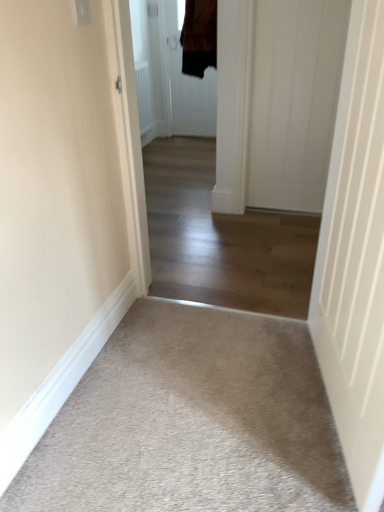
Describe the element at coordinates (199, 37) in the screenshot. I see `brown suede jacket at upper center` at that location.

Where is `beige carpet at lower left`? The image size is (384, 512). beige carpet at lower left is located at coordinates (192, 421).

Find the location of a particular element. brown fabric door at center, the 1th door positioned from the left is located at coordinates pyautogui.click(x=191, y=99).

Identify the location of light beige carpet at center. Image resolution: width=384 pixels, height=512 pixels. (221, 238).

In the scene shown: What is the approximate height of white smooth door at right, the third door positioned from the back?

white smooth door at right, the third door positioned from the back, is 1.02 meters tall.

The width and height of the screenshot is (384, 512). In order to click on brown suede jacket at upper center in this screenshot , I will do `click(199, 37)`.

Considering the sizes of objects brown fabric door at center, the first door positioned from the back, and white smooth door at right, the second door when ordered from left to right, in the image provided, who is taller, brown fabric door at center, the first door positioned from the back, or white smooth door at right, the second door when ordered from left to right,?

Standing taller between the two is brown fabric door at center, the first door positioned from the back.

Considering the sizes of objects brown fabric door at center, the 1th door positioned from the left, and white smooth door at right, the third door positioned from the back, in the image provided, who is thinner, brown fabric door at center, the 1th door positioned from the left, or white smooth door at right, the third door positioned from the back,?

Thinner between the two is brown fabric door at center, the 1th door positioned from the left.

Can you confirm if brown fabric door at center, the first door positioned from the back, is positioned to the right of white smooth door at right, the 1th door from the front?

No, brown fabric door at center, the first door positioned from the back, is not to the right of white smooth door at right, the 1th door from the front.

Does light beige carpet at center come in front of brown fabric door at center, the 3th door positioned from the bottom?

Yes, it is.

Is light beige carpet at center oriented away from brown fabric door at center, the 1th door when ordered from top to bottom?

No, light beige carpet at center's orientation is not away from brown fabric door at center, the 1th door when ordered from top to bottom.

Is light beige carpet at center directly adjacent to brown fabric door at center, which ranks as the third door in front-to-back order?

No, light beige carpet at center is not touching brown fabric door at center, which ranks as the third door in front-to-back order.

How different are the orientations of light beige carpet at center and brown fabric door at center, which ranks as the third door in front-to-back order, in degrees?

There is a 1.04-degree angle between the facing directions of light beige carpet at center and brown fabric door at center, which ranks as the third door in front-to-back order.

How different are the orientations of white smooth door at right, the first door from the bottom, and light beige carpet at center in degrees?

79.2 degrees.

Does white smooth door at right, which is the 3th door in top-to-bottom order, have a lesser height compared to light beige carpet at center?

In fact, white smooth door at right, which is the 3th door in top-to-bottom order, may be taller than light beige carpet at center.

Is the depth of white smooth door at right, the third door positioned from the back, less than that of light beige carpet at center?

Yes, the depth of white smooth door at right, the third door positioned from the back, is less than that of light beige carpet at center.

From the image's perspective, is white smooth door at right, the 1th door from the front, above or below light beige carpet at center?

Based on their image positions, white smooth door at right, the 1th door from the front, is located beneath light beige carpet at center.

What are the coordinates of `corridor behind the beige carpet at lower left` in the screenshot? It's located at (221, 238).

Is beige carpet at lower left next to light beige carpet at center and touching it?

No, beige carpet at lower left is not making contact with light beige carpet at center.

Which object is positioned more to the right, beige carpet at lower left or light beige carpet at center?

Positioned to the right is beige carpet at lower left.

Could you tell me if beige carpet at lower left is facing light beige carpet at center?

Yes, beige carpet at lower left is aimed at light beige carpet at center.

From a real-world perspective, is white smooth door at right, the first door from the bottom, over brown fabric door at center, the 3th door positioned from the bottom?

No, from a real-world perspective, white smooth door at right, the first door from the bottom, is not on top of brown fabric door at center, the 3th door positioned from the bottom.

Find the location of a particular element. This screenshot has width=384, height=512. door that is the 2nd one when counting upward from the white smooth door at right, the second door when ordered from left to right (from the image's perspective) is located at coordinates (191, 99).

Is white smooth door at right, the third door positioned from the back, in contact with brown fabric door at center, which ranks as the third door in front-to-back order?

No, white smooth door at right, the third door positioned from the back, is not touching brown fabric door at center, which ranks as the third door in front-to-back order.

Is white smooth door at right, the first door from the bottom, aimed at brown fabric door at center, the 3th door positioned from the bottom?

No.

Considering the positions of points (207, 286) and (287, 133), is point (207, 286) farther from camera compared to point (287, 133)?

No.

Is white smooth door at right, marked as the second door in a back-to-front arrangement, located within light beige carpet at center?

No, white smooth door at right, marked as the second door in a back-to-front arrangement, is not surrounded by light beige carpet at center.

From a real-world perspective, is light beige carpet at center located higher than white smooth door at right, marked as the second door in a back-to-front arrangement?

Incorrect, from a real-world perspective, light beige carpet at center is lower than white smooth door at right, marked as the second door in a back-to-front arrangement.

Which of these two, brown fabric door at center, the 3th door positioned from the bottom, or brown suede jacket at upper center, is thinner?

Thinner between the two is brown fabric door at center, the 3th door positioned from the bottom.

Can you confirm if brown fabric door at center, which appears as the 3th door when viewed from the right, is shorter than brown suede jacket at upper center?

In fact, brown fabric door at center, which appears as the 3th door when viewed from the right, may be taller than brown suede jacket at upper center.

From the image's perspective, is brown fabric door at center, the first door positioned from the back, positioned above or below brown suede jacket at upper center?

Clearly, from the image's perspective, brown fabric door at center, the first door positioned from the back, is above brown suede jacket at upper center.

From a real-world perspective, which door is the 2nd one above the white smooth door at right, the third door positioned from the back? Please provide its 2D coordinates.

[(191, 99)]

You are a GUI agent. You are given a task and a screenshot of the screen. Output one action in this format:
    pyautogui.click(x=<x>, y=<y>)
    Task: Click on the corridor on the right of brown fabric door at center, the 1th door positioned from the left
    
    Given the screenshot: What is the action you would take?
    pyautogui.click(x=221, y=238)

Estimate the real-world distances between objects in this image. Which object is further from light beige carpet at center, beige carpet at lower left or white smooth door at right, the 1th door from the front?

white smooth door at right, the 1th door from the front, is positioned further to the anchor light beige carpet at center.

Considering their positions, is brown suede jacket at upper center positioned closer to white smooth door at right, the first door from the bottom, than white smooth door at right, which ranks as the second door in bottom-to-top order?

white smooth door at right, which ranks as the second door in bottom-to-top order.

Looking at the image, which one is located closer to beige carpet at lower left, white smooth door at right, the third door in the left-to-right sequence, or light beige carpet at center?

light beige carpet at center.

Based on the photo, estimate the real-world distances between objects in this image. Which object is further from brown suede jacket at upper center, light beige carpet at center or white smooth door at right, marked as the second door in a back-to-front arrangement?

Among the two, light beige carpet at center is located further to brown suede jacket at upper center.

Which object lies nearer to the anchor point white smooth door at right, marked as the second door in a back-to-front arrangement, white smooth door at right, the second door when ordered from left to right, or brown suede jacket at upper center?

brown suede jacket at upper center is closer to white smooth door at right, marked as the second door in a back-to-front arrangement.

Based on the photo, when comparing their distances from white smooth door at right, the third door positioned from the back, does white smooth door at right, positioned as the second door in front-to-back order, or brown fabric door at center, which ranks as the third door in front-to-back order, seem closer?

white smooth door at right, positioned as the second door in front-to-back order, lies closer to white smooth door at right, the third door positioned from the back, than the other object.

Which object lies further to the anchor point brown suede jacket at upper center, white smooth door at right, positioned as the second door in right-to-left order, or light beige carpet at center?

white smooth door at right, positioned as the second door in right-to-left order.

Based on their spatial positions, is brown fabric door at center, which appears as the 3th door when viewed from the right, or brown suede jacket at upper center closer to white smooth door at right, the second door when ordered from left to right?

Among the two, brown suede jacket at upper center is located nearer to white smooth door at right, the second door when ordered from left to right.

I want to click on plain between white smooth door at right, the second door when ordered from left to right, and brown fabric door at center, the 1th door when ordered from top to bottom, along the z-axis, so click(192, 421).

Locate an element on the screen. The height and width of the screenshot is (512, 384). corridor that lies between white smooth door at right, arranged as the 2th door when viewed from the top, and beige carpet at lower left from top to bottom is located at coordinates (221, 238).

Where is `corridor between white smooth door at right, which is the 3th door in top-to-bottom order, and white smooth door at right, marked as the second door in a back-to-front arrangement, from front to back`? corridor between white smooth door at right, which is the 3th door in top-to-bottom order, and white smooth door at right, marked as the second door in a back-to-front arrangement, from front to back is located at coordinates (221, 238).

Where is `jacket between white smooth door at right, which is the 3th door in top-to-bottom order, and brown fabric door at center, the 3th door positioned from the bottom, along the z-axis`? The width and height of the screenshot is (384, 512). jacket between white smooth door at right, which is the 3th door in top-to-bottom order, and brown fabric door at center, the 3th door positioned from the bottom, along the z-axis is located at coordinates (199, 37).